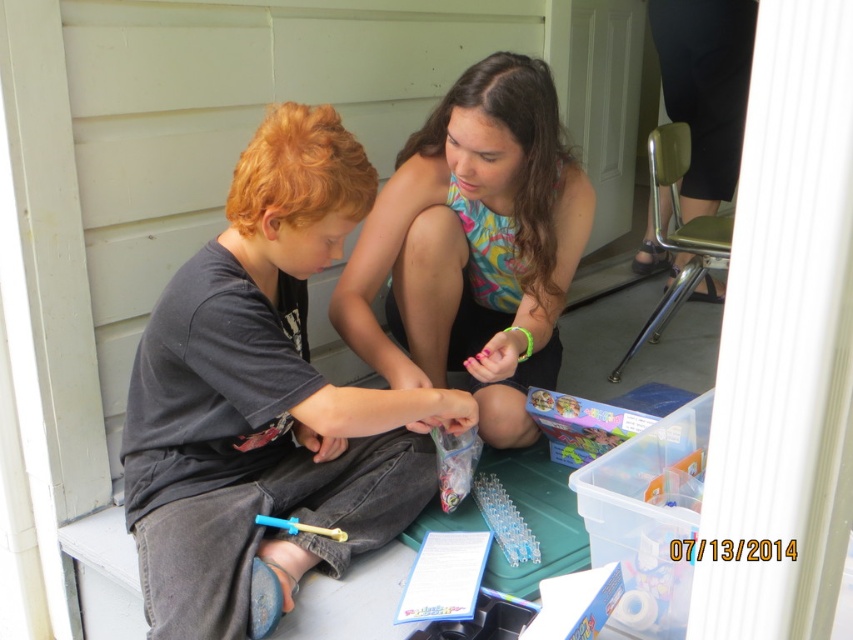
Between dark gray t-shirt at left and multicolored fabric shirt at center, which one has more height?

With more height is dark gray t-shirt at left.

Does dark gray t-shirt at left have a smaller size compared to multicolored fabric shirt at center?

No.

This screenshot has width=853, height=640. I want to click on dark gray t-shirt at left, so click(x=265, y=403).